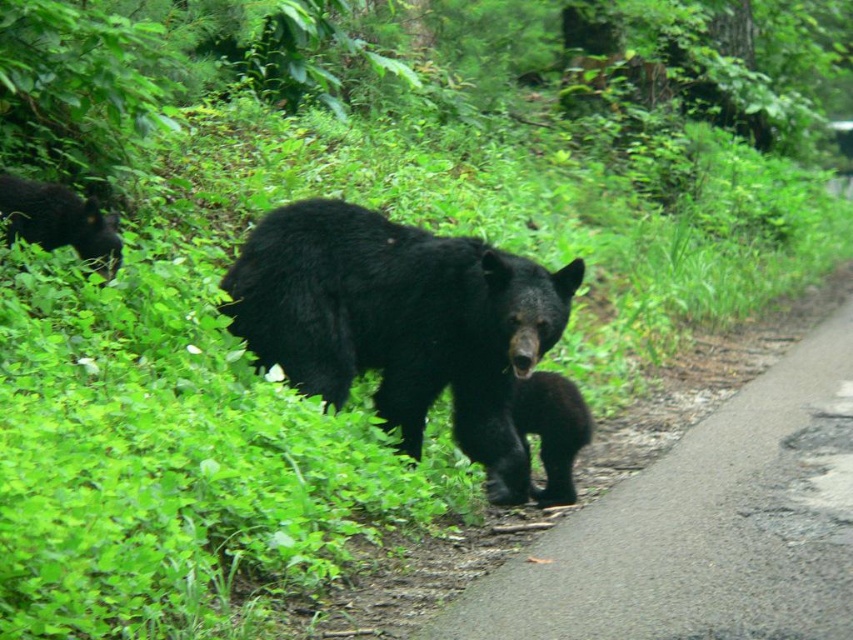
Question: Which point is farther to the camera?

Choices:
 (A) (77, 230)
 (B) (387, 320)
 (C) (549, 497)

Answer: (A)

Question: Is shiny black bear at left positioned before black furry bear cub at center?

Choices:
 (A) yes
 (B) no

Answer: (B)

Question: Which object appears farthest from the camera in this image?

Choices:
 (A) black furry bear cub at center
 (B) black furry bear at center
 (C) shiny black bear at left

Answer: (C)

Question: Which point is closer to the camera taking this photo?

Choices:
 (A) (108, 227)
 (B) (534, 301)

Answer: (B)

Question: Does black furry bear at center appear under black furry bear cub at center?

Choices:
 (A) no
 (B) yes

Answer: (A)

Question: Can you confirm if black furry bear at center is positioned above shiny black bear at left?

Choices:
 (A) no
 (B) yes

Answer: (A)